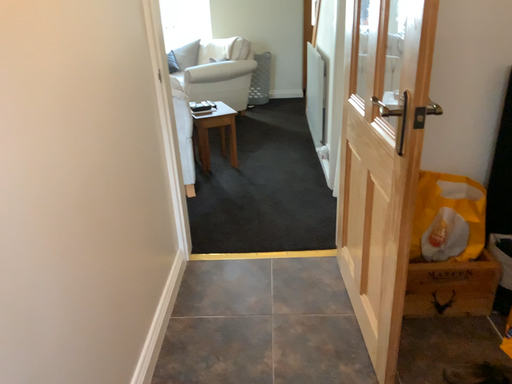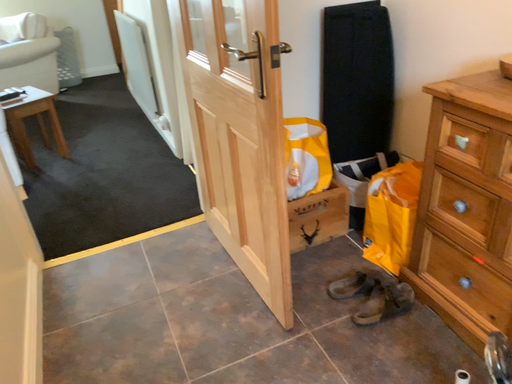
Question: Which way did the camera rotate in the video?

Choices:
 (A) rotated right
 (B) rotated left

Answer: (A)